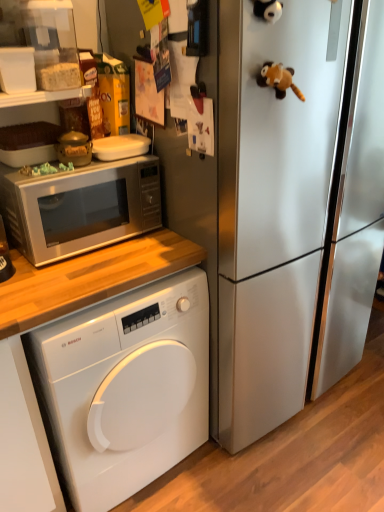
Question: Is satin silver microwave at upper left spatially inside white glossy washing machine at lower left, or outside of it?

Choices:
 (A) outside
 (B) inside

Answer: (A)

Question: Based on their positions, is satin silver microwave at upper left located to the left or right of white glossy washing machine at lower left?

Choices:
 (A) left
 (B) right

Answer: (A)

Question: Which object is the farthest from the satin silver microwave at upper left?

Choices:
 (A) white glossy washing machine at lower left
 (B) brown plush toy at upper right
 (C) satin silver refrigerator at center

Answer: (B)

Question: Which of these objects is positioned farthest from the satin silver microwave at upper left?

Choices:
 (A) satin silver refrigerator at center
 (B) brown plush toy at upper right
 (C) white glossy washing machine at lower left

Answer: (B)